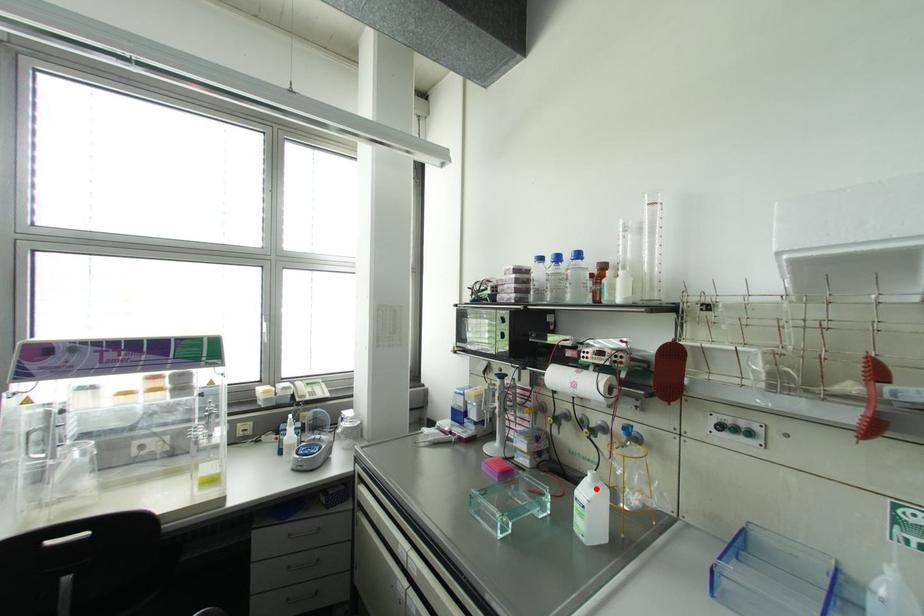
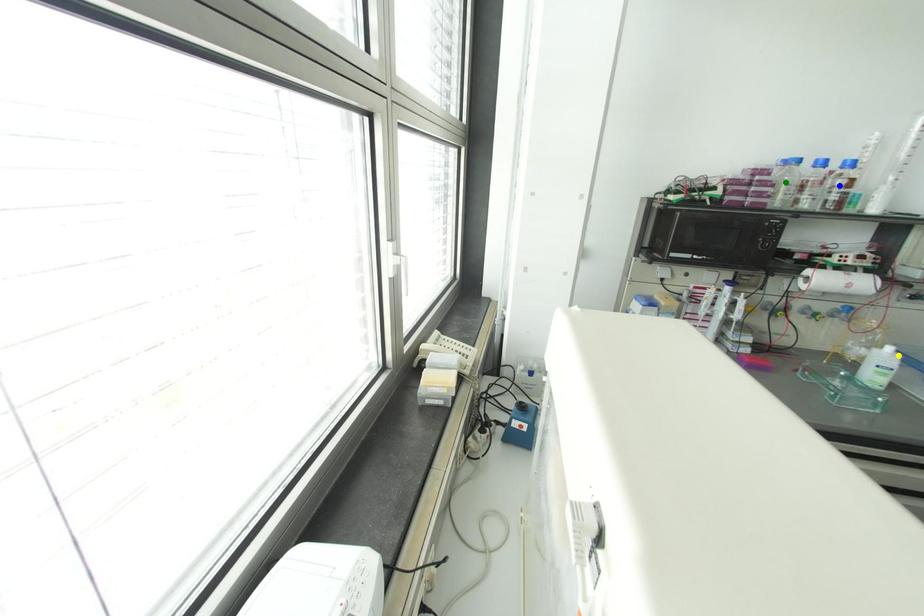
Question: I am providing you with two images of the same scene from different viewpoints. A red point is marked on the first image. You are given multiple points on the second image. In image 2, which mark is for the same physical point as the one in image 1?

Choices:
 (A) blue point
 (B) yellow point
 (C) green point

Answer: (B)